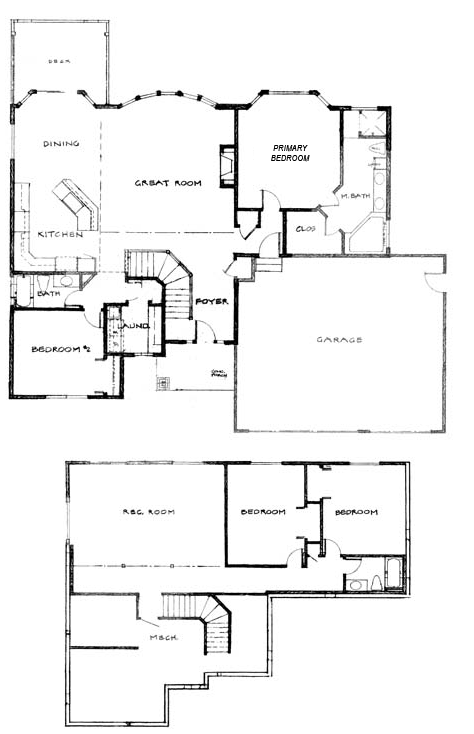
Find the location of a particular element. This screenshot has width=474, height=734. laundry room is located at coordinates (138, 324).